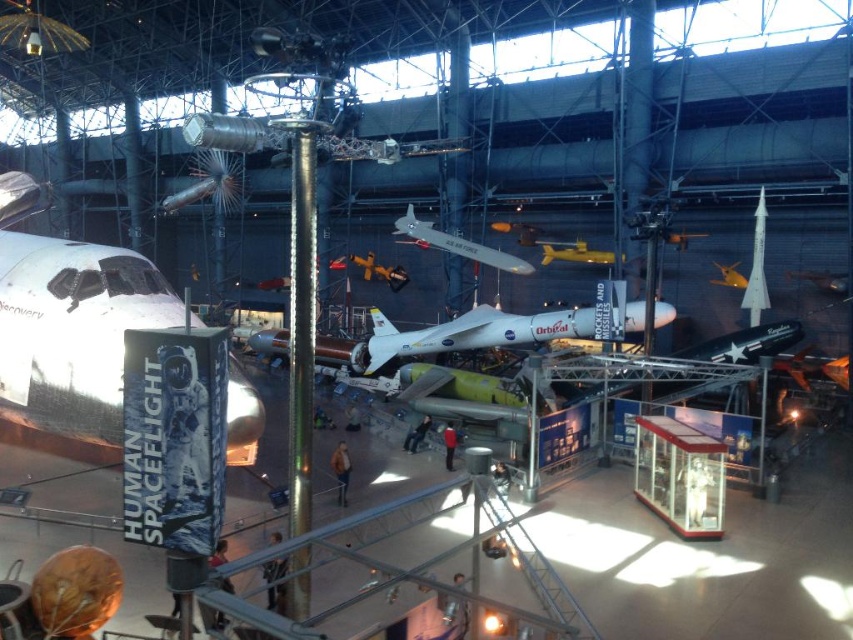
Question: Can you confirm if metallic yellow airplane at center is wider than metallic silver airplane at center?

Choices:
 (A) no
 (B) yes

Answer: (B)

Question: Which of the following is the closest to the observer?

Choices:
 (A) metallic yellow airplane at center
 (B) shiny silver airplane at upper right

Answer: (B)

Question: Considering the real-world distances, which object is closest to the white matte airplane at center?

Choices:
 (A) yellow matte airplane at center
 (B) shiny silver airplane at upper right
 (C) white glossy airplane at left
 (D) shiny metallic airplane at center

Answer: (D)

Question: Among these objects, which one is farthest from the camera?

Choices:
 (A) white glossy airplane at center
 (B) shiny silver airplane at upper right
 (C) metallic silver airplane at center

Answer: (C)

Question: Does metallic yellow airplane at center have a smaller size compared to metallic silver airplane at center?

Choices:
 (A) yes
 (B) no

Answer: (B)

Question: Does white glossy airplane at left have a greater width compared to shiny metallic airplane at center?

Choices:
 (A) no
 (B) yes

Answer: (B)